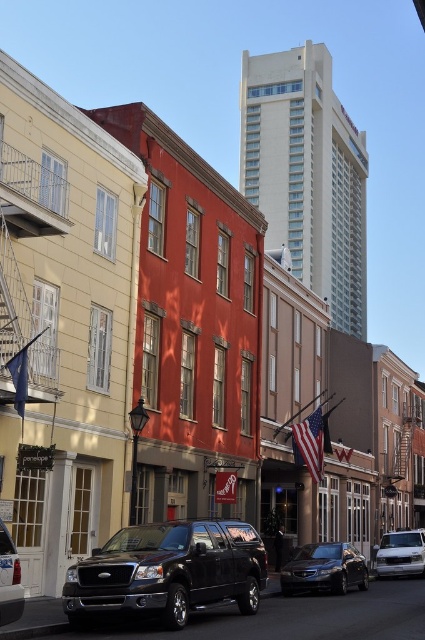
You are standing at the camera position looking at the street scene. There are two points marked on the image, one at coordinates point (19, 588) and the other at point (25, 381). Which point is nearer to you?

Point (19, 588) is closer to the camera than point (25, 381), so the point at (19, 588) is nearer to you.

You are a delivery driver who needs to park your 15 feet long delivery van between the shiny black sedan at center and the shiny black truck at lower left. Is there enough space between them for your van?

The distance between the shiny black sedan at center and the shiny black truck at lower left is 58.32 feet. Since your delivery van is 15 feet long, there is sufficient space between them to park your van.

You are a delivery person trying to park your van in the street. You see the shiny black truck at lower left and the blue fabric flag at lower left. Which object takes up more space in the parking area?

The shiny black truck at lower left takes up more space in the parking area since it is larger in size compared to the blue fabric flag at lower left.